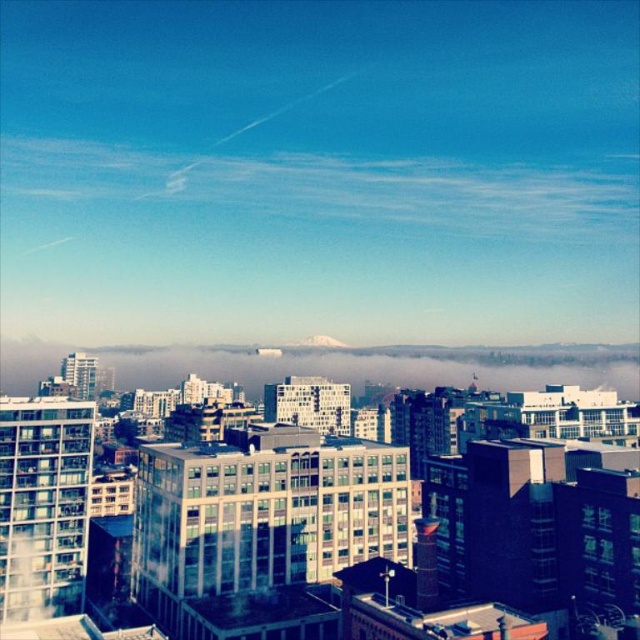
How distant is white translucent fog at center from white snow-covered mountain at center?

white translucent fog at center and white snow-covered mountain at center are 138.73 feet apart from each other.

Which is behind, point (124, 364) or point (307, 344)?

Positioned behind is point (124, 364).

Image resolution: width=640 pixels, height=640 pixels. Identify the location of white translucent fog at center. (381, 365).

From the picture: Is white wispy cloud at upper center to the left of white translucent fog at center from the viewer's perspective?

Incorrect, white wispy cloud at upper center is not on the left side of white translucent fog at center.

Looking at this image, is white wispy cloud at upper center taller than white translucent fog at center?

Indeed, white wispy cloud at upper center has a greater height compared to white translucent fog at center.

Is point (273, 173) more distant than point (336, 348)?

Yes, it is.

The image size is (640, 640). In order to click on white wispy cloud at upper center in this screenshot , I will do `click(330, 188)`.

Is white wispy cloud at upper center to the left of white snow-covered mountain at center from the viewer's perspective?

Correct, you'll find white wispy cloud at upper center to the left of white snow-covered mountain at center.

Locate an element on the screen. Image resolution: width=640 pixels, height=640 pixels. white wispy cloud at upper center is located at coordinates (330, 188).

This screenshot has height=640, width=640. Identify the location of white wispy cloud at upper center. (330, 188).